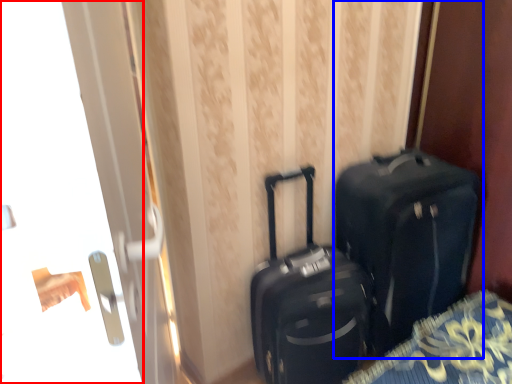
Question: Which object appears closest to the camera in this image, screen door (highlighted by a red box) or luggage and bags (highlighted by a blue box)?

Choices:
 (A) screen door
 (B) luggage and bags

Answer: (A)